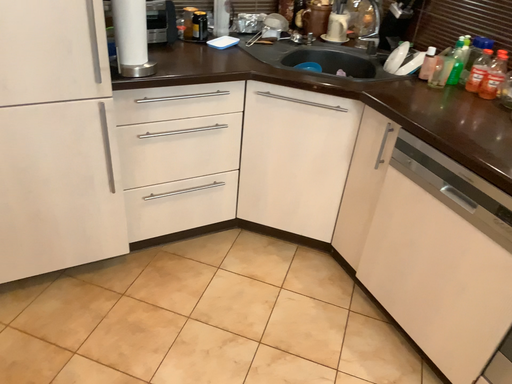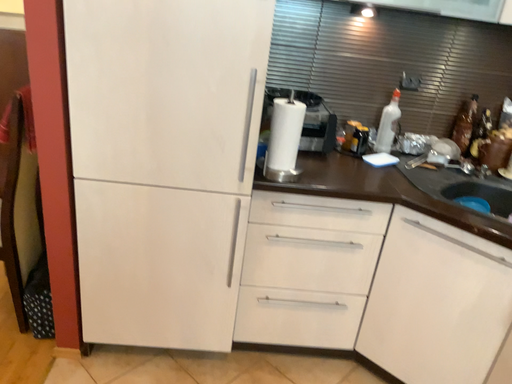
Question: Which way did the camera rotate in the video?

Choices:
 (A) rotated right
 (B) rotated left

Answer: (B)